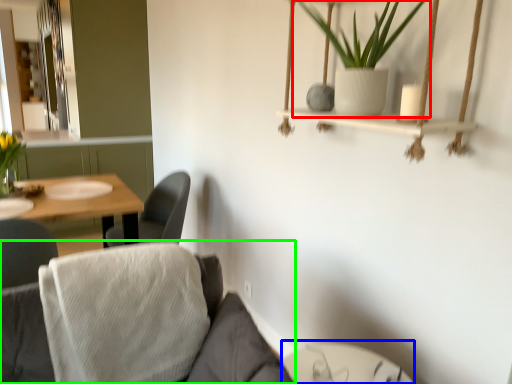
Question: Considering the real-world distances, which object is closest to houseplant (highlighted by a red box)? glass table (highlighted by a blue box) or couch (highlighted by a green box).

Choices:
 (A) glass table
 (B) couch

Answer: (B)